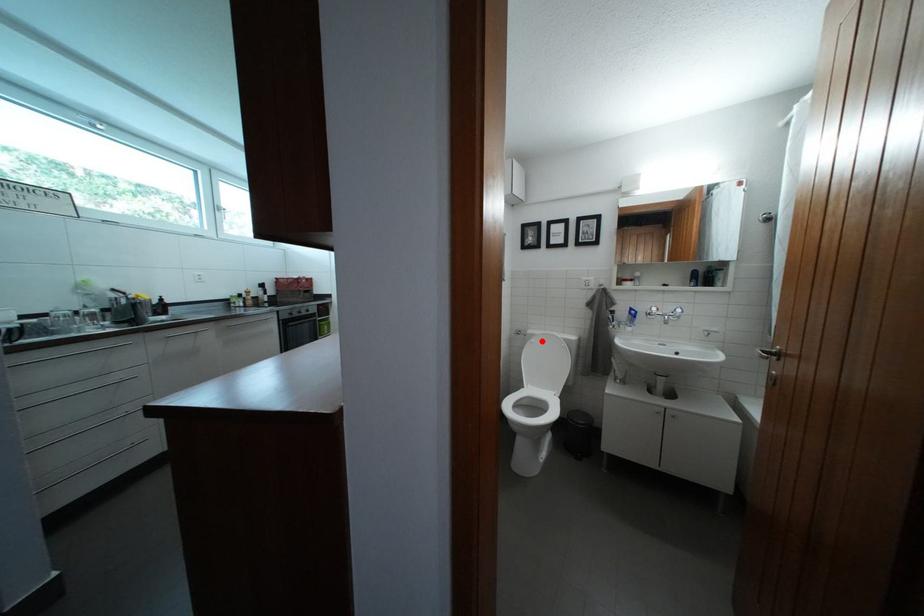
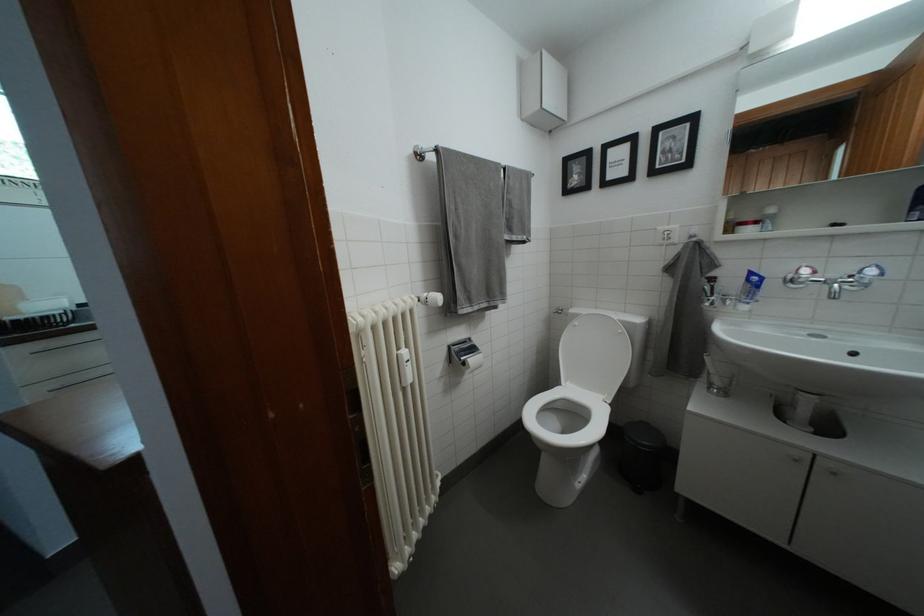
Locate, in the second image, the point that corresponds to the highlighted location in the first image.

(585, 321)